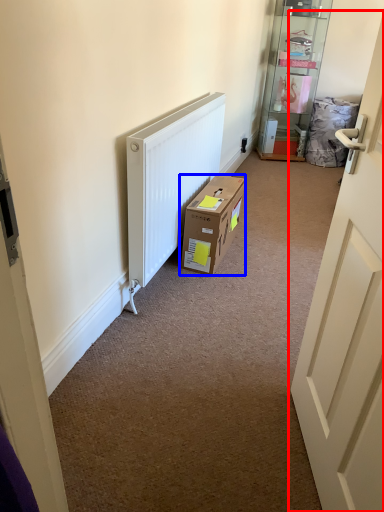
Question: Which object appears closest to the camera in this image, door (highlighted by a red box) or box (highlighted by a blue box)?

Choices:
 (A) door
 (B) box

Answer: (A)